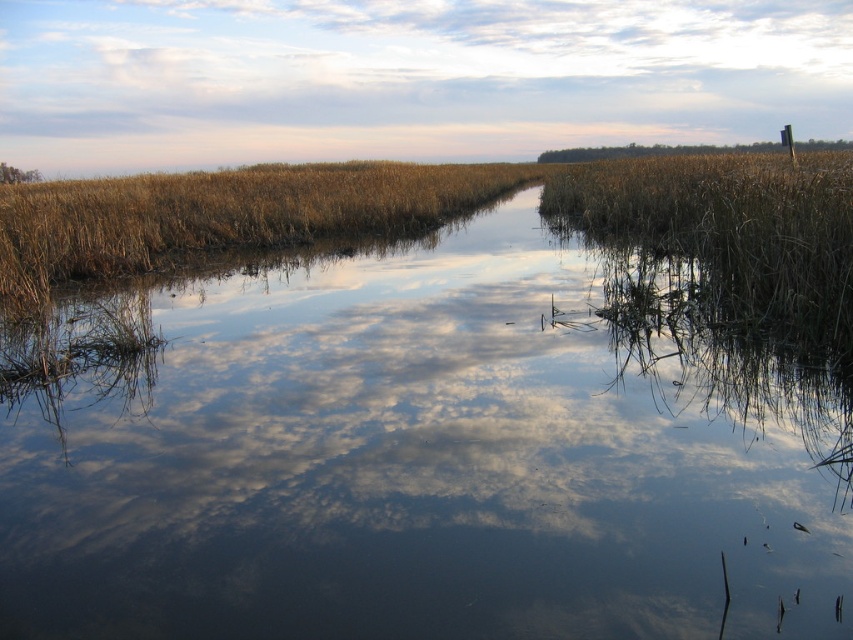
Is brown grassy stream at center wider than cloudy sky at upper center?

No, brown grassy stream at center is not wider than cloudy sky at upper center.

Is point (300, 616) in front of point (317, 147)?

Yes, it is in front of point (317, 147).

Locate an element on the screen. This screenshot has width=853, height=640. brown grassy stream at center is located at coordinates (422, 458).

Where is `brown grassy stream at center`? brown grassy stream at center is located at coordinates (422, 458).